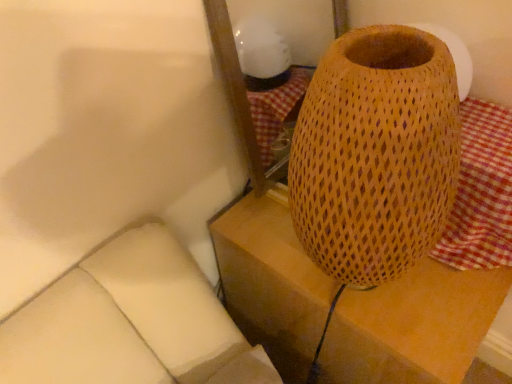
Question: Relative to red checkered fabric at right, is woven wood lampshade at right in front or behind?

Choices:
 (A) front
 (B) behind

Answer: (B)

Question: Considering the positions of woven wood lampshade at right and red checkered fabric at right in the image, is woven wood lampshade at right wider or thinner than red checkered fabric at right?

Choices:
 (A) thin
 (B) wide

Answer: (B)

Question: From a real-world perspective, is woven wood lampshade at right positioned above or below red checkered fabric at right?

Choices:
 (A) above
 (B) below

Answer: (B)

Question: Considering the positions of red checkered fabric at right and woven wood lampshade at right in the image, is red checkered fabric at right wider or thinner than woven wood lampshade at right?

Choices:
 (A) wide
 (B) thin

Answer: (B)

Question: Considering their positions, is red checkered fabric at right located in front of or behind woven wood lampshade at right?

Choices:
 (A) front
 (B) behind

Answer: (A)

Question: Is point (499, 175) closer or farther from the camera than point (433, 344)?

Choices:
 (A) closer
 (B) farther

Answer: (B)

Question: From a real-world perspective, relative to woven wood lampshade at right, is red checkered fabric at right vertically above or below?

Choices:
 (A) above
 (B) below

Answer: (A)